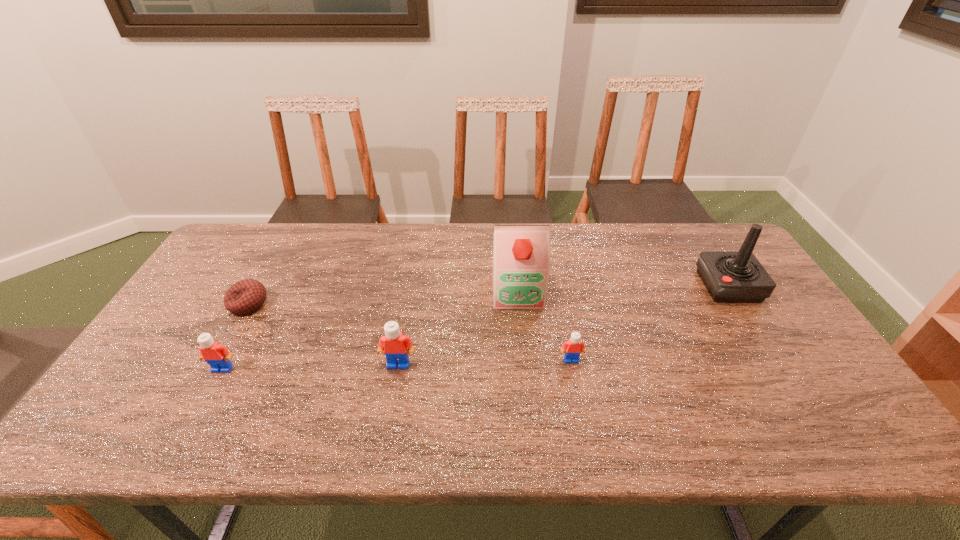
Locate an element on the screen. vacant region that satisfies the following two spatial constraints: 1. on the front-facing side of the joystick; 2. on the face of the second tallest Lego is located at coordinates (780, 368).

Identify the location of blank area in the image that satisfies the following two spatial constraints: 1. on the front-facing side of the rightmost object; 2. on the face of the shortest Lego. The height and width of the screenshot is (540, 960). pyautogui.click(x=775, y=360).

Locate an element on the screen. Image resolution: width=960 pixels, height=540 pixels. free spot that satisfies the following two spatial constraints: 1. on the front-facing side of the joystick; 2. on the face of the rightmost Lego is located at coordinates (775, 360).